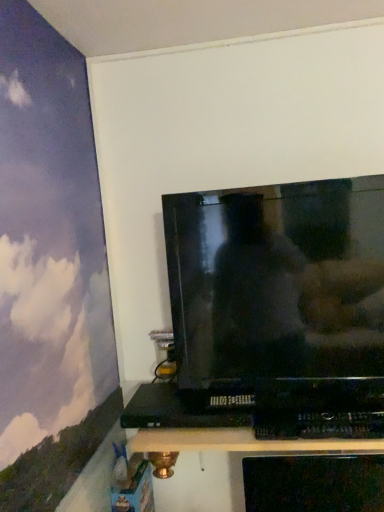
Question: Does black plastic dvd player at lower center have a larger size compared to glossy black tv at upper center?

Choices:
 (A) no
 (B) yes

Answer: (A)

Question: Does black plastic dvd player at lower center lie behind glossy black tv at upper center?

Choices:
 (A) no
 (B) yes

Answer: (B)

Question: Is black plastic dvd player at lower center to the left of glossy black tv at upper center from the viewer's perspective?

Choices:
 (A) no
 (B) yes

Answer: (B)

Question: Is black plastic dvd player at lower center wider than glossy black tv at upper center?

Choices:
 (A) yes
 (B) no

Answer: (A)

Question: Could you tell me if black plastic dvd player at lower center is facing glossy black tv at upper center?

Choices:
 (A) yes
 (B) no

Answer: (A)

Question: In the image, is glossy black tv at upper center positioned in front of or behind black plastic shelf at lower center?

Choices:
 (A) behind
 (B) front

Answer: (A)

Question: Considering the positions of point (286, 187) and point (160, 431), is point (286, 187) closer or farther from the camera than point (160, 431)?

Choices:
 (A) closer
 (B) farther

Answer: (A)

Question: Based on their sizes in the image, would you say glossy black tv at upper center is bigger or smaller than black plastic shelf at lower center?

Choices:
 (A) small
 (B) big

Answer: (A)

Question: From a real-world perspective, relative to black plastic shelf at lower center, is glossy black tv at upper center vertically above or below?

Choices:
 (A) below
 (B) above

Answer: (B)

Question: From a real-world perspective, relative to black plastic shelf at lower center, is black plastic dvd player at lower center vertically above or below?

Choices:
 (A) below
 (B) above

Answer: (B)

Question: From their relative heights in the image, would you say black plastic dvd player at lower center is taller or shorter than black plastic shelf at lower center?

Choices:
 (A) tall
 (B) short

Answer: (B)

Question: In the image, is black plastic dvd player at lower center on the left side or the right side of black plastic shelf at lower center?

Choices:
 (A) right
 (B) left

Answer: (B)

Question: From the image's perspective, is black plastic dvd player at lower center positioned above or below black plastic shelf at lower center?

Choices:
 (A) above
 (B) below

Answer: (A)

Question: From a real-world perspective, is glossy black tv at upper center positioned above or below black plastic dvd player at lower center?

Choices:
 (A) below
 (B) above

Answer: (B)

Question: Looking at the image, does glossy black tv at upper center seem bigger or smaller compared to black plastic dvd player at lower center?

Choices:
 (A) small
 (B) big

Answer: (B)